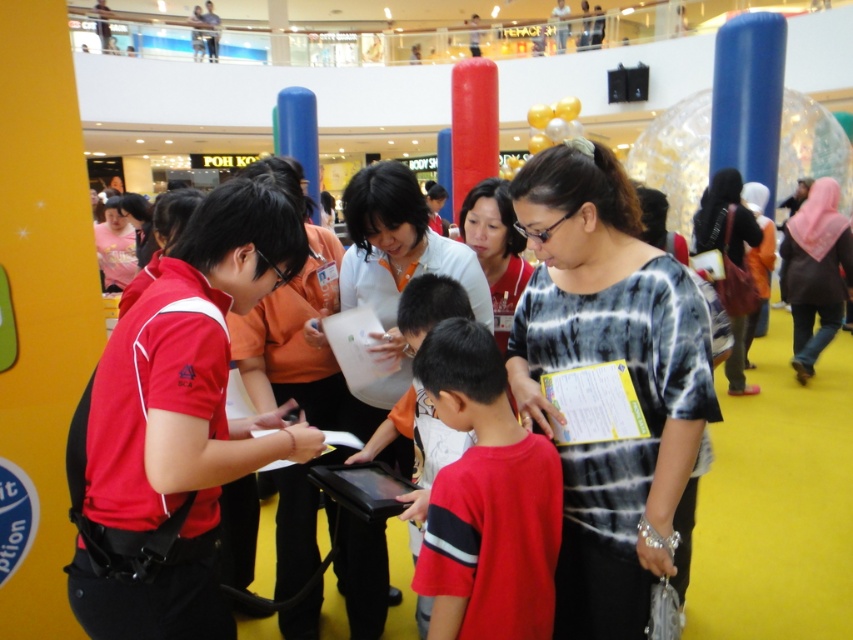
Is point (698, 428) farther from viewer compared to point (485, 205)?

No, it is not.

The height and width of the screenshot is (640, 853). What do you see at coordinates (607, 381) in the screenshot?
I see `black tie-dye shirt at center` at bounding box center [607, 381].

This screenshot has width=853, height=640. What do you see at coordinates (607, 381) in the screenshot? I see `black tie-dye shirt at center` at bounding box center [607, 381].

At what (x,y) coordinates should I click in order to perform the action: click on black tie-dye shirt at center. Please return your answer as a coordinate pair (x, y). The image size is (853, 640). Looking at the image, I should click on (607, 381).

What do you see at coordinates (383, 259) in the screenshot?
I see `white matte shirt at center` at bounding box center [383, 259].

Is white matte shirt at center shorter than matte black shirt at right?

Indeed, white matte shirt at center has a lesser height compared to matte black shirt at right.

Is point (393, 198) less distant than point (723, 172)?

That is True.

Identify the location of white matte shirt at center. (383, 259).

From the picture: Does red cotton shirt at center have a lesser width compared to matte black shirt at right?

Indeed, red cotton shirt at center has a lesser width compared to matte black shirt at right.

Can you confirm if red cotton shirt at center is positioned to the right of matte black shirt at right?

Incorrect, red cotton shirt at center is not on the right side of matte black shirt at right.

Does point (427, 346) come farther from viewer compared to point (749, 212)?

No, it is in front of (749, 212).

Where is `red cotton shirt at center`? This screenshot has width=853, height=640. red cotton shirt at center is located at coordinates (486, 499).